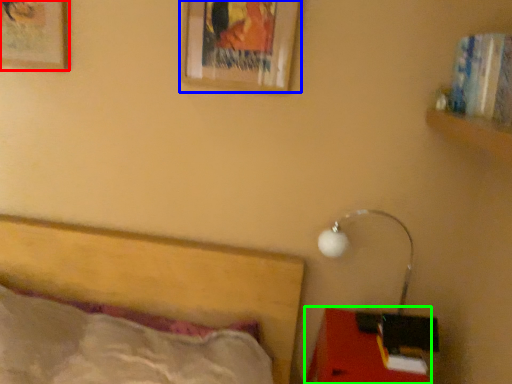
Question: Which object is positioned closest to picture frame (highlighted by a red box)? Select from picture frame (highlighted by a blue box) and furniture (highlighted by a green box).

Choices:
 (A) picture frame
 (B) furniture

Answer: (A)